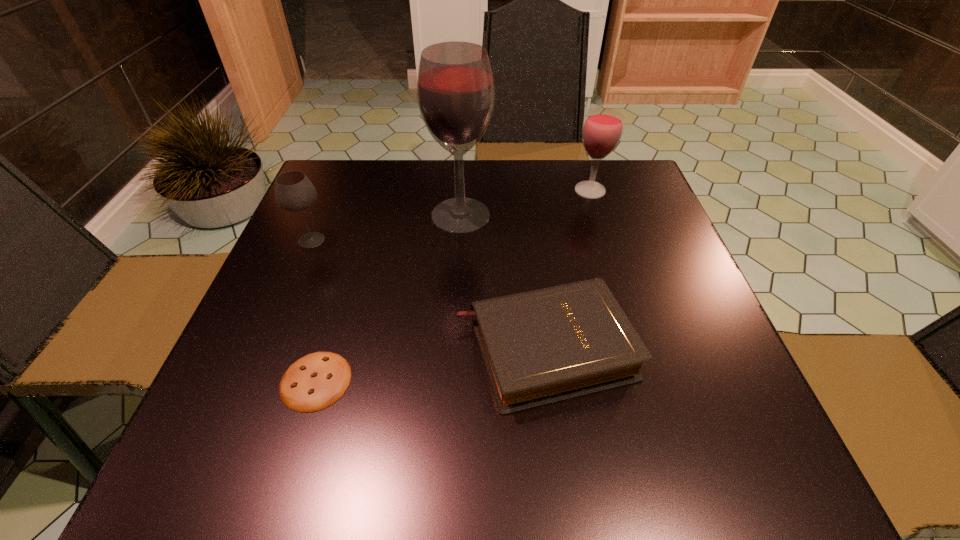
The height and width of the screenshot is (540, 960). I want to click on free space that is in between the fourth object from right to left and the fourth tallest object, so click(430, 364).

The image size is (960, 540). In order to click on vacant area that lies between the second shortest object and the tallest object in this screenshot , I will do `click(503, 281)`.

Identify the location of vacant area that lies between the shortest object and the alcohol. (388, 298).

Locate an element on the screen. The height and width of the screenshot is (540, 960). vacant space that is in between the tallest object and the right wineglass is located at coordinates (525, 202).

Where is `free spot between the second tallest object and the fourth object from right to left`? free spot between the second tallest object and the fourth object from right to left is located at coordinates (453, 286).

I want to click on free space between the Bible and the alcohol, so click(x=503, y=281).

What are the coordinates of `vacant area between the alcohol and the second object from left to right` in the screenshot? It's located at (388, 298).

Find the location of a particular element. object identified as the fourth closest to the alcohol is located at coordinates (317, 380).

Locate which object is the fourth closest to the fourth tallest object. Please provide its 2D coordinates. Your answer should be formatted as a tuple, i.e. [(x, y)], where the tuple contains the x and y coordinates of a point satisfying the conditions above.

[(294, 192)]

Locate an element on the screen. This screenshot has width=960, height=540. vacant area in the image that satisfies the following two spatial constraints: 1. on the front side of the nearer wineglass; 2. on the left side of the cookie is located at coordinates (252, 381).